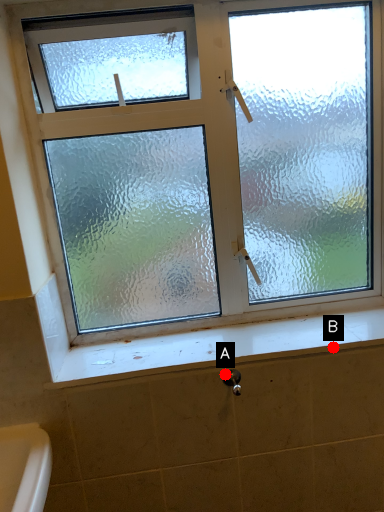
Question: Two points are circled on the image, labeled by A and B beside each circle. Which of the following is the closest to the observer?

Choices:
 (A) A is closer
 (B) B is closer

Answer: (A)